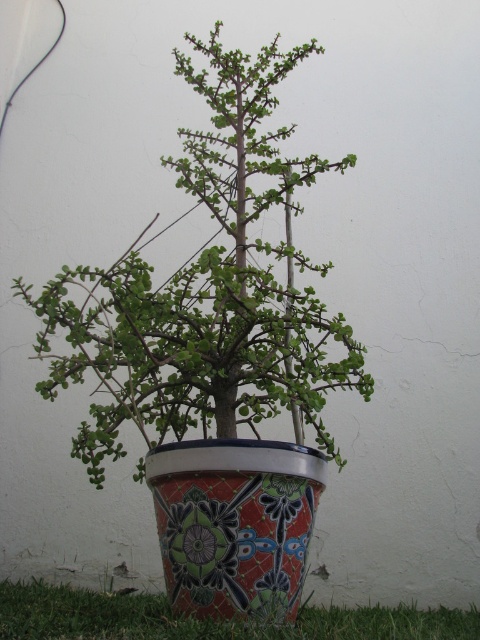
Question: Can you confirm if green glossy plant at center is smaller than matte ceramic pot at center?

Choices:
 (A) no
 (B) yes

Answer: (A)

Question: Which object appears farthest from the camera in this image?

Choices:
 (A) matte ceramic pot at center
 (B) green glossy plant at center

Answer: (B)

Question: Does green glossy plant at center appear over matte ceramic pot at center?

Choices:
 (A) no
 (B) yes

Answer: (B)

Question: Can you confirm if green glossy plant at center is positioned to the left of matte ceramic pot at center?

Choices:
 (A) yes
 (B) no

Answer: (A)